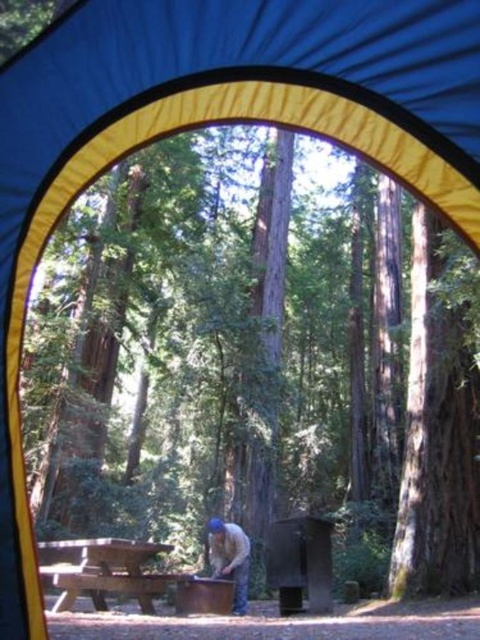
You are setting up a campsite and need to place a brown leather jacket at lower center on the wooden picnic table at center. Can the jacket fit on the table?

The wooden picnic table at center has a larger width than the brown leather jacket at lower center, so the jacket can fit on the table.